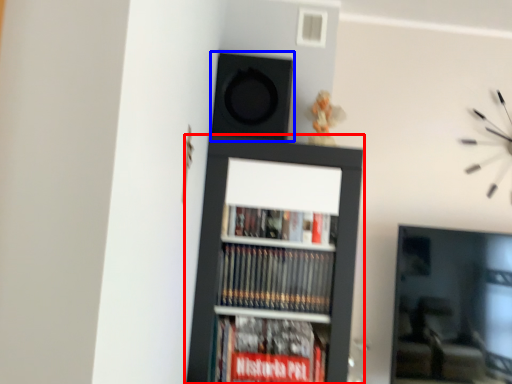
Question: Which point is closer to the camera, bookcase (highlighted by a red box) or speaker (highlighted by a blue box)?

Choices:
 (A) bookcase
 (B) speaker

Answer: (A)